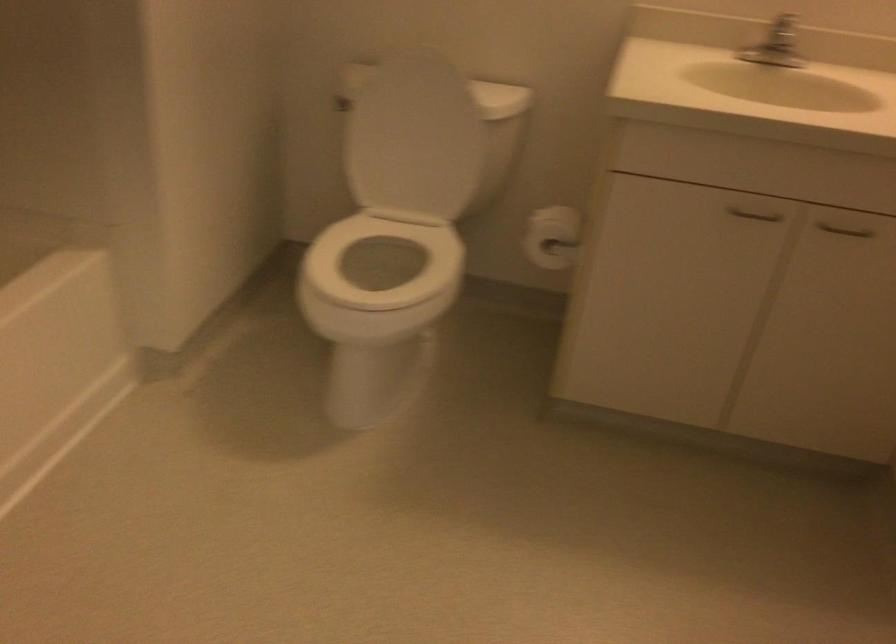
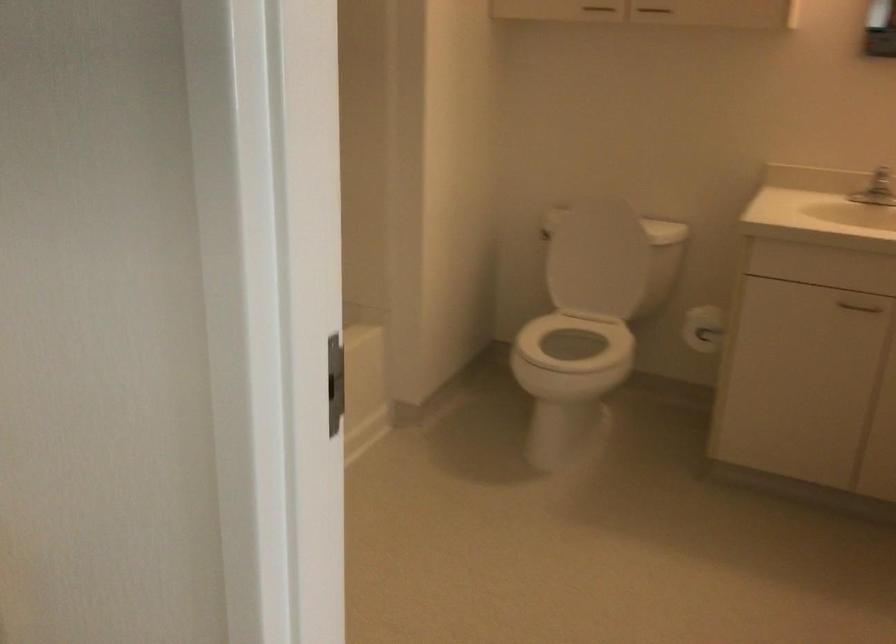
The point at (389, 268) is marked in the first image. Where is the corresponding point in the second image?

(571, 357)